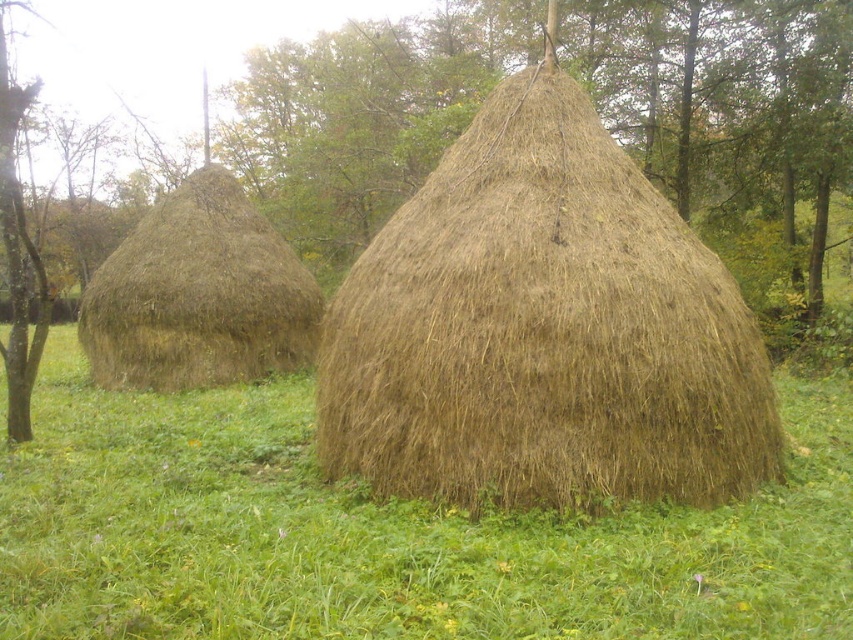
Between brown straw bale at center and brown straw stack at center, which one is positioned lower?

brown straw bale at center is below.

Who is more distant from viewer, (4, 508) or (399, 358)?

Point (399, 358)

Identify the location of brown straw bale at center. [383, 532].

Does brown straw stack at center appear under brown straw hut at left?

Actually, brown straw stack at center is above brown straw hut at left.

The height and width of the screenshot is (640, 853). Describe the element at coordinates (543, 330) in the screenshot. I see `brown straw stack at center` at that location.

This screenshot has width=853, height=640. Identify the location of brown straw stack at center. (543, 330).

What do you see at coordinates (383, 532) in the screenshot? I see `brown straw bale at center` at bounding box center [383, 532].

Who is more forward, [152,483] or [83,298]?

Positioned in front is point [152,483].

The width and height of the screenshot is (853, 640). Identify the location of brown straw bale at center. (383, 532).